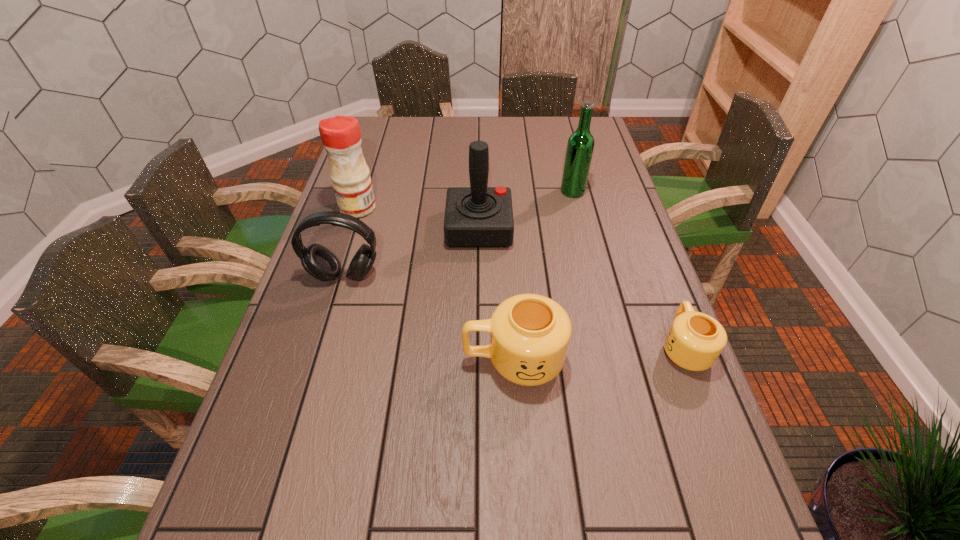
Locate an element on the screen. The image size is (960, 540). headset positioned at the left edge is located at coordinates (318, 261).

The height and width of the screenshot is (540, 960). Identify the location of mug present at the right edge. (695, 340).

Identify the location of beer bottle that is positioned at the right edge. This screenshot has height=540, width=960. (580, 146).

The height and width of the screenshot is (540, 960). Find the location of `free location at the far edge of the desktop`. free location at the far edge of the desktop is located at coordinates [430, 129].

In the image, there is a desktop. Where is `free space at the near edge`? free space at the near edge is located at coordinates (548, 458).

Image resolution: width=960 pixels, height=540 pixels. Identify the location of blank area at the left edge. (327, 396).

The height and width of the screenshot is (540, 960). I want to click on free location at the right edge of the desktop, so click(x=599, y=170).

Locate an element on the screen. This screenshot has height=540, width=960. free space at the far right corner of the desktop is located at coordinates (570, 123).

I want to click on free area in between the beer bottle and the joystick, so pos(526,210).

You are a GUI agent. You are given a task and a screenshot of the screen. Output one action in this format:
    pyautogui.click(x=<x>, y=<y>)
    Task: Click on the vacant space in between the joystick and the fourth tallest object
    This screenshot has width=960, height=540.
    Given the screenshot: What is the action you would take?
    [x=412, y=252]